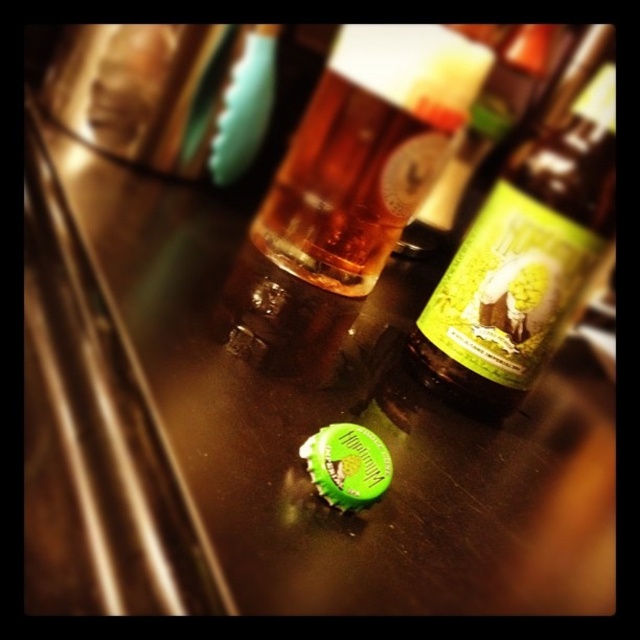
Who is higher up, green matte bottle at center or translucent amber glass at center?

translucent amber glass at center is above.

Is green matte bottle at center further to camera compared to translucent amber glass at center?

No, it is not.

The width and height of the screenshot is (640, 640). I want to click on green matte bottle at center, so click(529, 246).

Where is `green matte bottle at center`? green matte bottle at center is located at coordinates (529, 246).